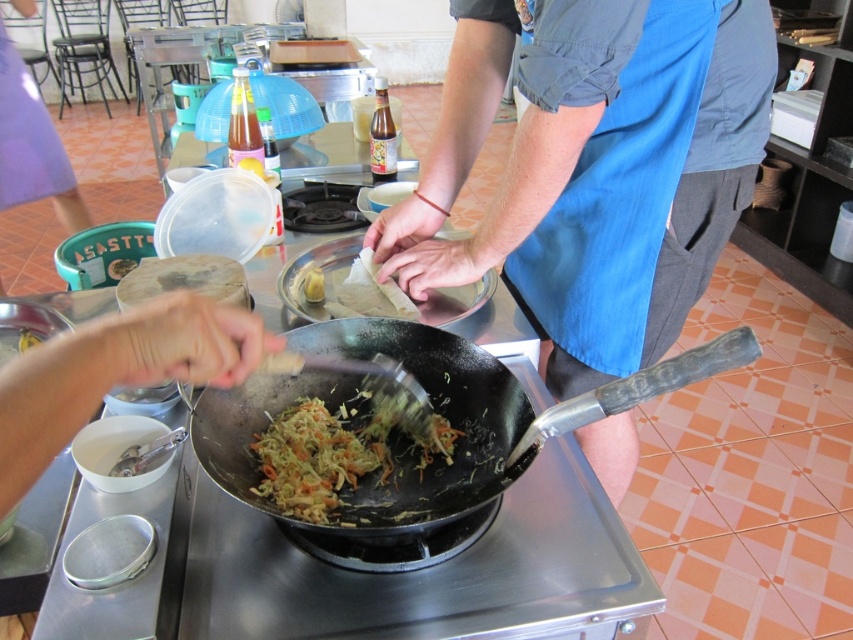
You are a chef preparing a dish and need to know which item takes up more space on the countertop. Which is larger between the blue fabric apron at center and the shiny brown noodles at center?

The blue fabric apron at center is bigger than the shiny brown noodles at center, so the blue fabric apron at center takes up more space on the countertop.